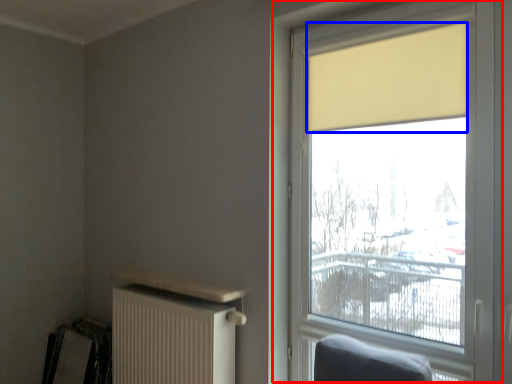
Question: Among these objects, which one is nearest to the camera, window (highlighted by a red box) or curtain (highlighted by a blue box)?

Choices:
 (A) window
 (B) curtain

Answer: (A)